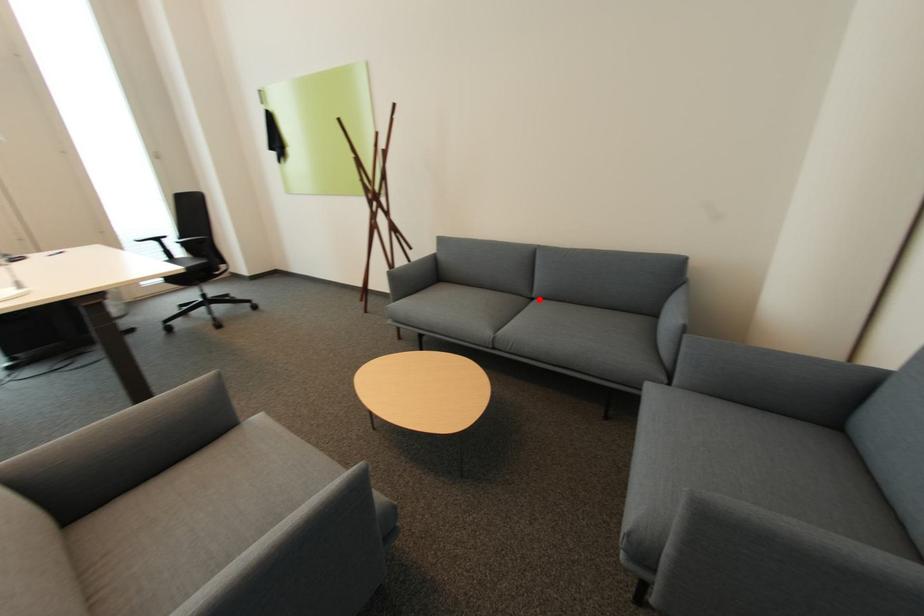
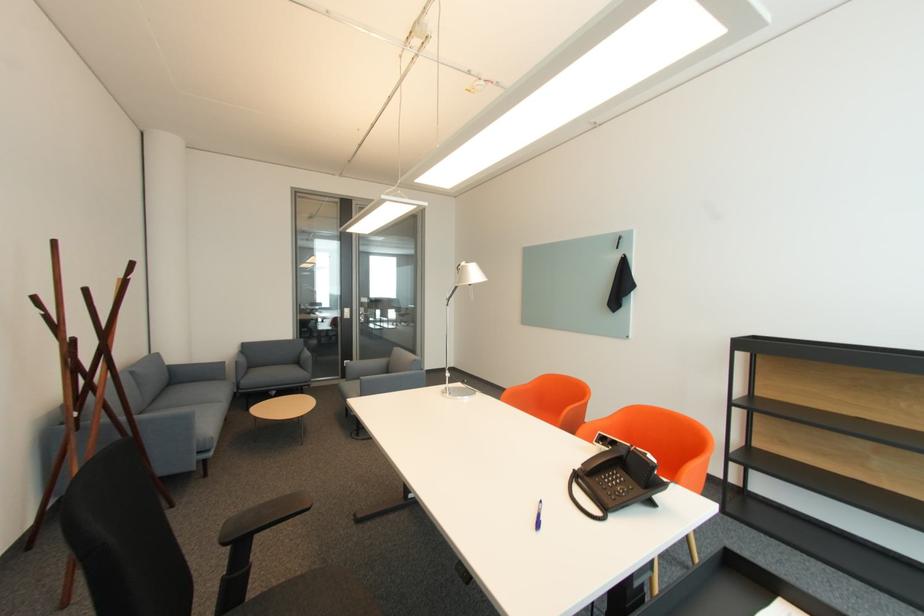
Question: I am providing you with two images of the same scene from different viewpoints. Image1 has a red point marked. In image2, the corresponding 3D location appears at what relative position? Reply with the corresponding letter.

Choices:
 (A) Closer
 (B) Farther

Answer: (B)